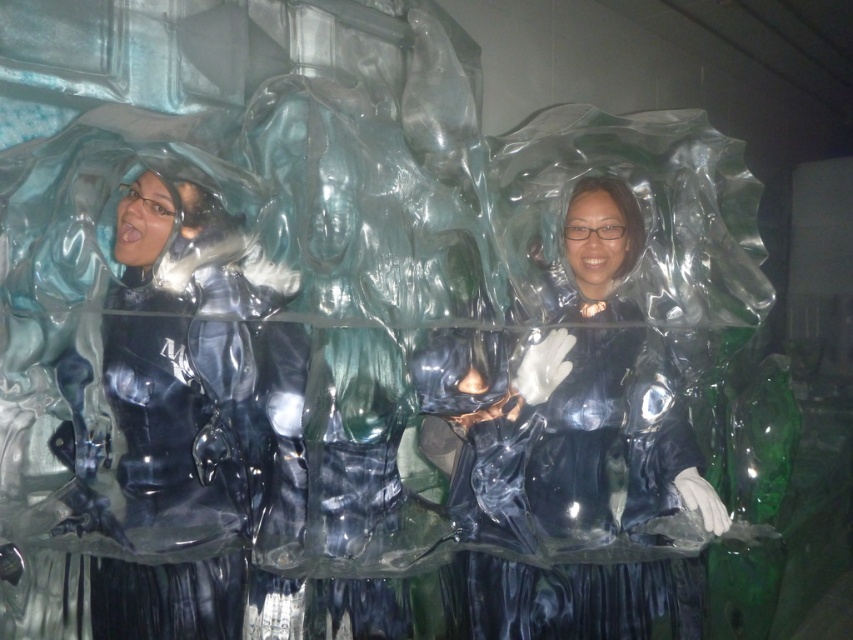
Looking at this image, you are standing in front of the image and want to touch the point at coordinates point (x=482, y=573). Is this point within reach of your outstretched hand? Assume your arm is 2.5 feet long.

The point (x=482, y=573) is 5.77 feet from viewer, which is farther than your arm length of 2.5 feet. You cannot reach it.

Consider the image. You are an artist trying to create a sculpture based on the scene. You have two transparent plastic figures. One is the transparent plastic person at center and the other is the transparent plastic figure at left. Which one should you choose if you want to make a larger sculpture?

The transparent plastic figure at left is larger than the transparent plastic person at center, so you should choose the transparent plastic figure at left to make a larger sculpture.

You are an observer standing in front of the image. You see a transparent plastic person at center and a transparent plastic figure at left. Which one is more to the left?

The transparent plastic figure at left is more to the left.